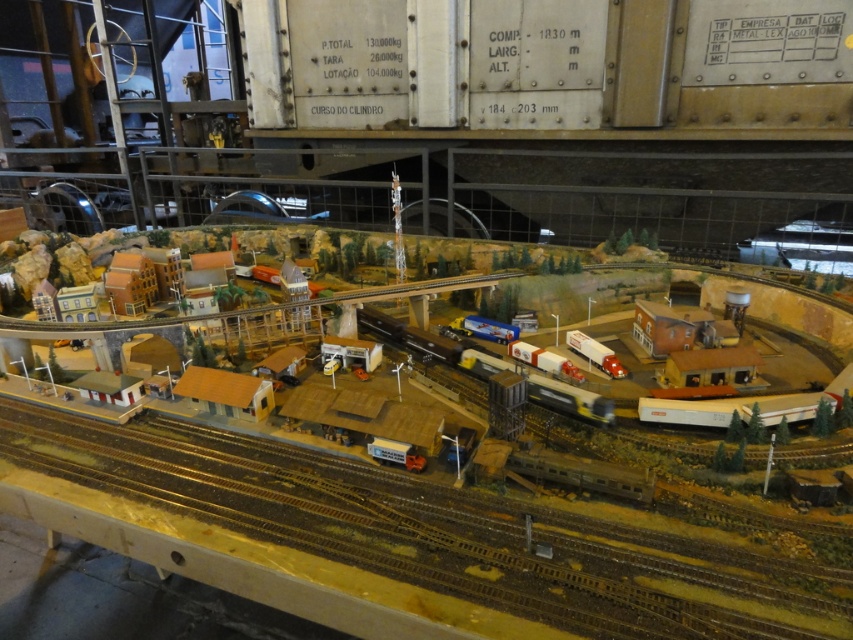
Does brown wooden train track at center appear over orange matte train car at center?

No.

Describe the element at coordinates (426, 531) in the screenshot. I see `brown wooden train track at center` at that location.

The width and height of the screenshot is (853, 640). I want to click on brown wooden train track at center, so click(x=426, y=531).

Is the position of brown wooden train track at center more distant than that of metallic silver train at center?

No, it is in front of metallic silver train at center.

Which is above, brown wooden train track at center or metallic silver train at center?

metallic silver train at center is above.

This screenshot has width=853, height=640. What do you see at coordinates (426, 531) in the screenshot?
I see `brown wooden train track at center` at bounding box center [426, 531].

What are the coordinates of `brown wooden train track at center` in the screenshot? It's located at (426, 531).

Can you confirm if metallic silver train at center is positioned above orange matte train car at center?

Yes.

Does metallic silver train at center come behind orange matte train car at center?

That is True.

What are the coordinates of `metallic silver train at center` in the screenshot? It's located at (434, 344).